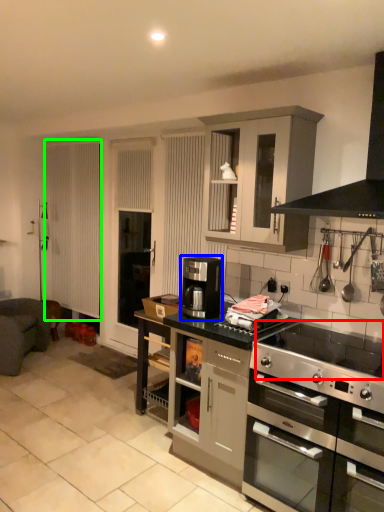
Question: Which object is positioned closest to gas stove (highlighted by a red box)? Select from coffee machine (highlighted by a blue box) and screen door (highlighted by a green box).

Choices:
 (A) coffee machine
 (B) screen door

Answer: (A)